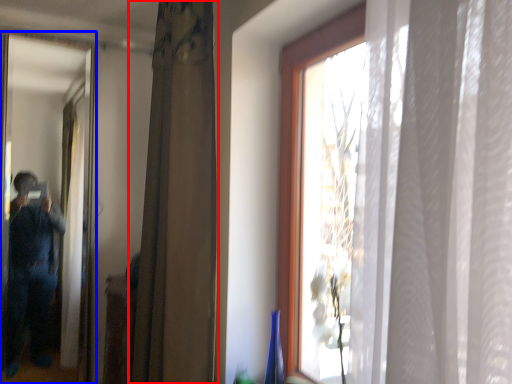
Question: Among these objects, which one is nearest to the camera, curtain (highlighted by a red box) or mirror (highlighted by a blue box)?

Choices:
 (A) curtain
 (B) mirror

Answer: (A)